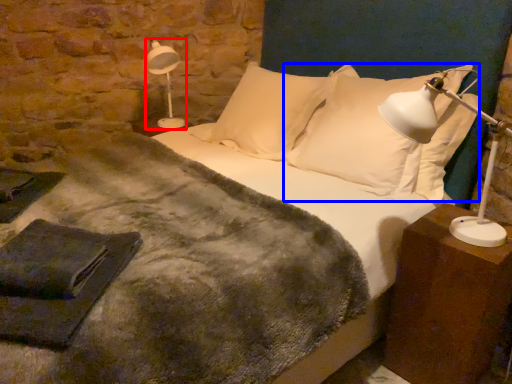
Question: Which of the following is the farthest to the observer, lamp (highlighted by a red box) or pillow (highlighted by a blue box)?

Choices:
 (A) lamp
 (B) pillow

Answer: (A)